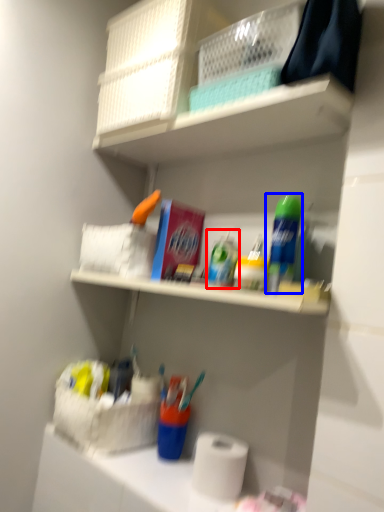
Question: Which object appears farthest to the camera in this image, toiletry (highlighted by a red box) or cleaning product (highlighted by a blue box)?

Choices:
 (A) toiletry
 (B) cleaning product

Answer: (A)